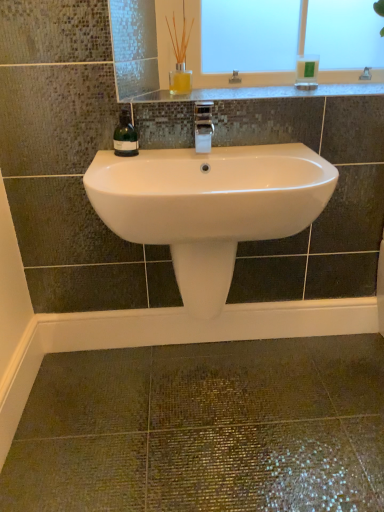
At what (x,y) coordinates should I click in order to perform the action: click on vacant area that lies to the right of white ceramic faucet at center. Please return your answer as a coordinate pair (x, y). Looking at the image, I should click on (263, 150).